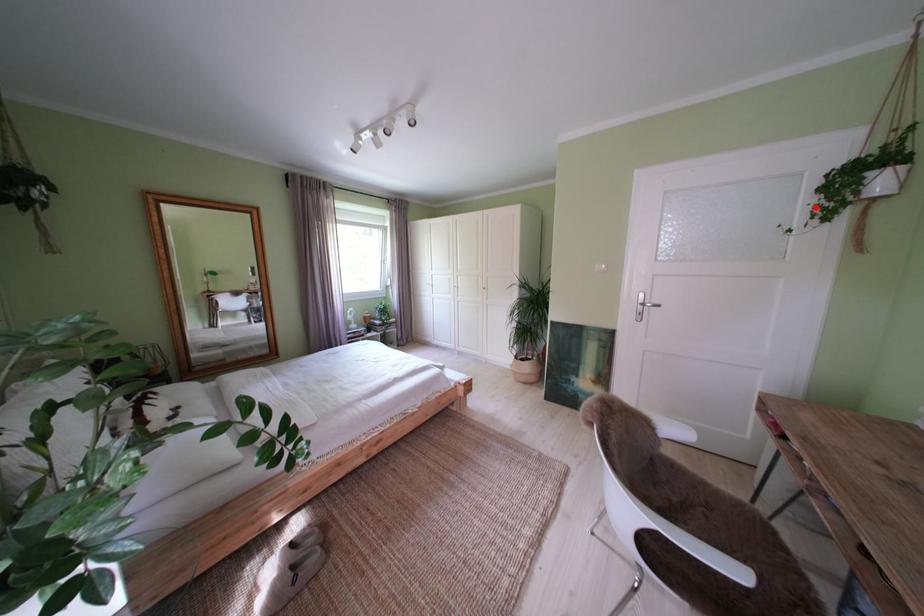
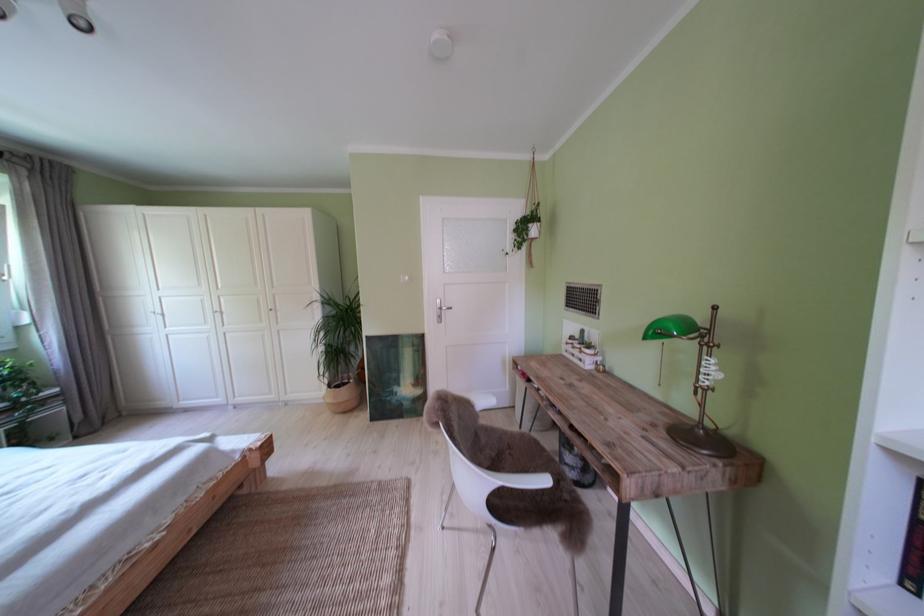
The point at the highlighted location is marked in the first image. Where is the corresponding point in the second image?

(520, 244)